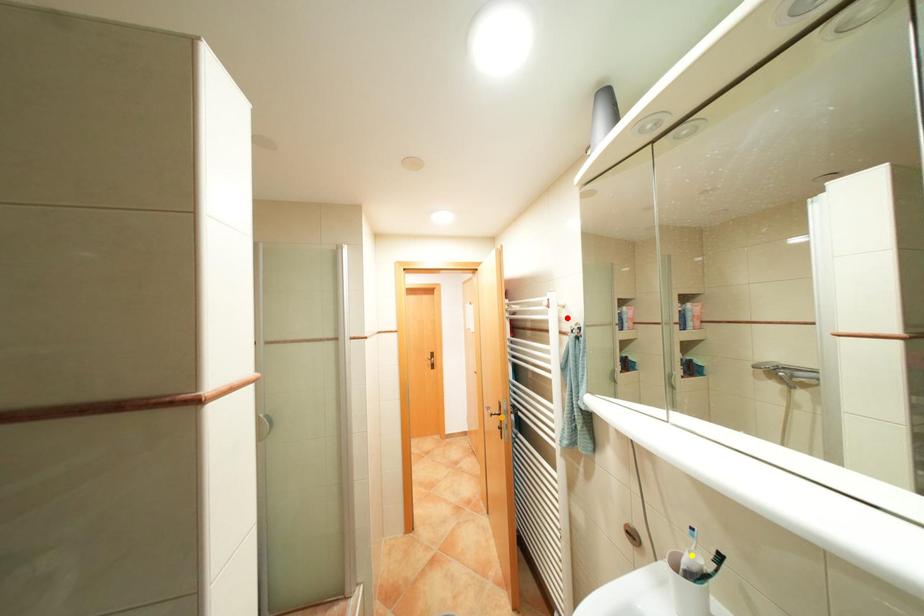
Order these from nearest to farthest:
red point, yellow point, orange point

yellow point → red point → orange point